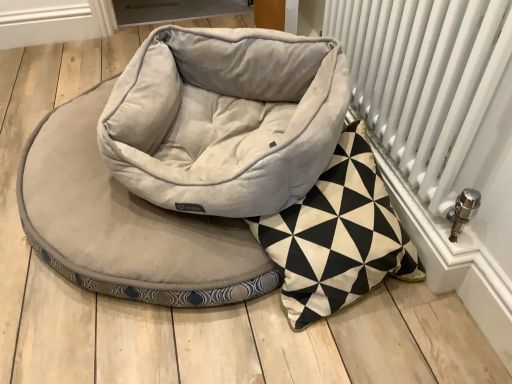
Question: Does suede-like beige dog bed at center touch white metal radiator at right?

Choices:
 (A) yes
 (B) no

Answer: (B)

Question: Does suede-like beige dog bed at center have a lesser width compared to white metal radiator at right?

Choices:
 (A) no
 (B) yes

Answer: (A)

Question: From a real-world perspective, is suede-like beige dog bed at center physically above white metal radiator at right?

Choices:
 (A) yes
 (B) no

Answer: (B)

Question: Is suede-like beige dog bed at center turned away from white metal radiator at right?

Choices:
 (A) no
 (B) yes

Answer: (A)

Question: Considering the relative sizes of suede-like beige dog bed at center and white metal radiator at right in the image provided, is suede-like beige dog bed at center smaller than white metal radiator at right?

Choices:
 (A) yes
 (B) no

Answer: (B)

Question: Does suede-like beige dog bed at center turn towards white metal radiator at right?

Choices:
 (A) yes
 (B) no

Answer: (B)

Question: Is white metal radiator at right closer to camera compared to suede-like beige dog bed at center?

Choices:
 (A) no
 (B) yes

Answer: (B)

Question: Does white metal radiator at right have a greater height compared to suede-like beige dog bed at center?

Choices:
 (A) no
 (B) yes

Answer: (B)

Question: Does white metal radiator at right lie behind suede-like beige dog bed at center?

Choices:
 (A) yes
 (B) no

Answer: (B)

Question: Could suede-like beige dog bed at center be considered to be inside white metal radiator at right?

Choices:
 (A) yes
 (B) no

Answer: (B)

Question: Does white metal radiator at right appear on the left side of suede-like beige dog bed at center?

Choices:
 (A) no
 (B) yes

Answer: (A)

Question: From a real-world perspective, is white metal radiator at right on suede-like beige dog bed at center?

Choices:
 (A) yes
 (B) no

Answer: (A)

Question: Would you say suede-like beige dog bed at center is to the left or to the right of white metal radiator at right in the picture?

Choices:
 (A) right
 (B) left

Answer: (B)